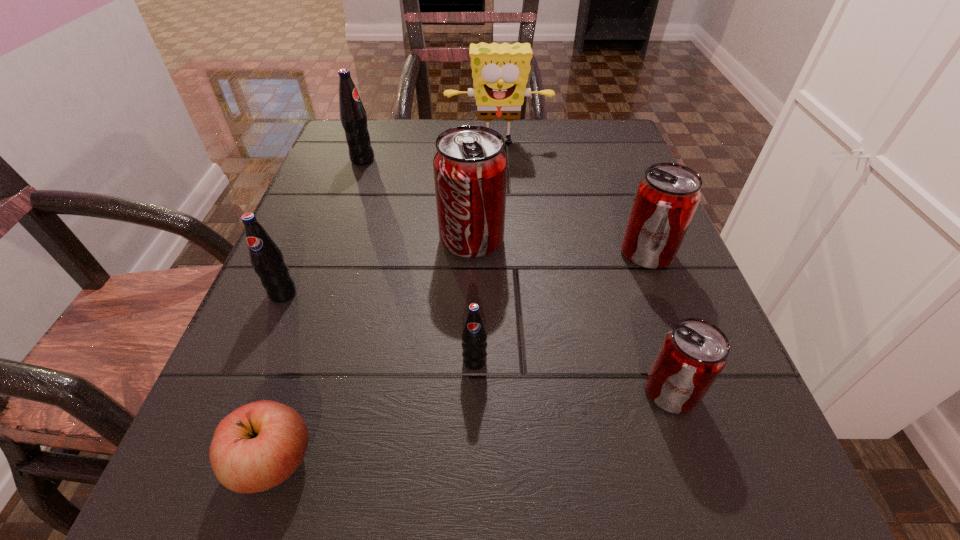
Identify the location of yellow sponge. pos(500,72).

At what (x,y) coordinates should I click in order to perform the action: click on the farthest black pop. Please return your answer as a coordinate pair (x, y). The image size is (960, 540). Looking at the image, I should click on (353, 117).

The height and width of the screenshot is (540, 960). Find the location of `the biggest black pop`. the biggest black pop is located at coordinates [x=353, y=117].

Where is `the leftmost red pop soda`? the leftmost red pop soda is located at coordinates (470, 164).

Where is `the leftmost object`? This screenshot has height=540, width=960. the leftmost object is located at coordinates (266, 257).

Where is `the leftmost pop`? The height and width of the screenshot is (540, 960). the leftmost pop is located at coordinates (266, 257).

This screenshot has width=960, height=540. I want to click on the second biggest red pop soda, so click(x=666, y=198).

The width and height of the screenshot is (960, 540). Find the location of `the nearest red pop soda`. the nearest red pop soda is located at coordinates (694, 352).

Where is `the nearest black pop`? The width and height of the screenshot is (960, 540). the nearest black pop is located at coordinates (474, 335).

Locate an element on the screen. Image resolution: width=960 pixels, height=540 pixels. the smallest black pop is located at coordinates (474, 335).